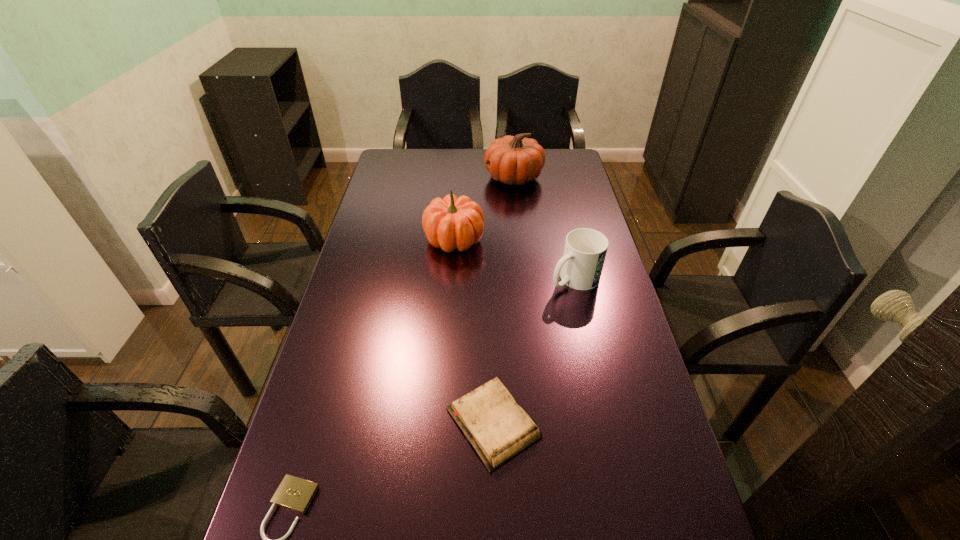
In the image, there is a desktop. Find the location of `vacant space at the right edge`. vacant space at the right edge is located at coordinates 573,219.

What are the coordinates of `vacant space at the far right corner` in the screenshot? It's located at (560, 153).

At what (x,y) coordinates should I click in order to perform the action: click on free space between the farthest object and the third nearest object. Please return your answer as a coordinate pair (x, y). Looking at the image, I should click on point(544,228).

The width and height of the screenshot is (960, 540). Find the location of `vacant space that's between the farther pumpkin and the third shortest object`. vacant space that's between the farther pumpkin and the third shortest object is located at coordinates (544, 228).

I want to click on free spot between the third farthest object and the left pumpkin, so click(x=515, y=259).

Where is `free space between the nearer pumpkin and the farther pumpkin`? Image resolution: width=960 pixels, height=540 pixels. free space between the nearer pumpkin and the farther pumpkin is located at coordinates (484, 208).

Point out which object is positioned as the third nearest to the diary. Please provide its 2D coordinates. Your answer should be formatted as a tuple, i.e. [(x, y)], where the tuple contains the x and y coordinates of a point satisfying the conditions above.

[(449, 223)]

Locate which object is the closest to the mug. Please provide its 2D coordinates. Your answer should be formatted as a tuple, i.e. [(x, y)], where the tuple contains the x and y coordinates of a point satisfying the conditions above.

[(449, 223)]

This screenshot has height=540, width=960. I want to click on free location that satisfies the following two spatial constraints: 1. on the front side of the fourth tallest object; 2. on the left side of the left pumpkin, so click(442, 423).

Find the location of a particular element. Image resolution: width=960 pixels, height=540 pixels. free space that satisfies the following two spatial constraints: 1. on the back side of the mug; 2. on the left side of the fourth farthest object is located at coordinates (490, 279).